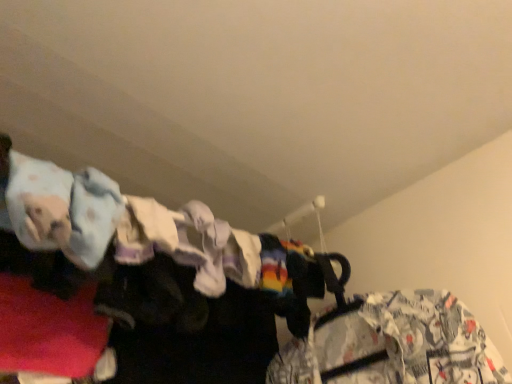
Question: Does white printed fabric at right, which is counted as the 1th clothing, starting from the right, appear on the left side of light blue fabric at upper left, acting as the second clothing starting from the bottom?

Choices:
 (A) no
 (B) yes

Answer: (A)

Question: Is white printed fabric at right, which is counted as the 1th clothing, starting from the right, closer to the viewer compared to light blue fabric at upper left, acting as the second clothing starting from the bottom?

Choices:
 (A) yes
 (B) no

Answer: (B)

Question: From the image's perspective, does white printed fabric at right, the 2th clothing viewed from the top, appear higher than light blue fabric at upper left, acting as the second clothing starting from the bottom?

Choices:
 (A) yes
 (B) no

Answer: (B)

Question: Can you confirm if white printed fabric at right, the second clothing in the front-to-back sequence, is taller than light blue fabric at upper left, which is the 1th clothing from top to bottom?

Choices:
 (A) no
 (B) yes

Answer: (B)

Question: From a real-world perspective, does white printed fabric at right, which is counted as the 1th clothing, starting from the right, sit lower than light blue fabric at upper left, which is the 1th clothing in front-to-back order?

Choices:
 (A) yes
 (B) no

Answer: (A)

Question: Does white printed fabric at right, which is counted as the second clothing, starting from the left, have a smaller size compared to light blue fabric at upper left, which is counted as the 2th clothing, starting from the back?

Choices:
 (A) no
 (B) yes

Answer: (A)

Question: Does light blue fabric at upper left, acting as the first clothing starting from the left, have a lesser height compared to white printed fabric at right, which is counted as the second clothing, starting from the left?

Choices:
 (A) yes
 (B) no

Answer: (A)

Question: Does light blue fabric at upper left, which is the 1th clothing from top to bottom, lie in front of white printed fabric at right, the first clothing from the back?

Choices:
 (A) yes
 (B) no

Answer: (A)

Question: Considering the relative sizes of light blue fabric at upper left, acting as the first clothing starting from the left, and white printed fabric at right, the 2th clothing viewed from the top, in the image provided, is light blue fabric at upper left, acting as the first clothing starting from the left, wider than white printed fabric at right, the 2th clothing viewed from the top,?

Choices:
 (A) yes
 (B) no

Answer: (A)

Question: Is light blue fabric at upper left, acting as the first clothing starting from the left, taller than white printed fabric at right, the 1th clothing when ordered from bottom to top?

Choices:
 (A) no
 (B) yes

Answer: (A)

Question: Can you confirm if light blue fabric at upper left, which is the 1th clothing in front-to-back order, is positioned to the left of white printed fabric at right, the first clothing from the back?

Choices:
 (A) no
 (B) yes

Answer: (B)

Question: From a real-world perspective, is light blue fabric at upper left, which is the 1th clothing from top to bottom, beneath white printed fabric at right, the first clothing from the back?

Choices:
 (A) yes
 (B) no

Answer: (B)

Question: Looking at the image, does white printed fabric at right, the 2th clothing viewed from the top, seem bigger or smaller compared to light blue fabric at upper left, which is the 1th clothing from top to bottom?

Choices:
 (A) big
 (B) small

Answer: (A)